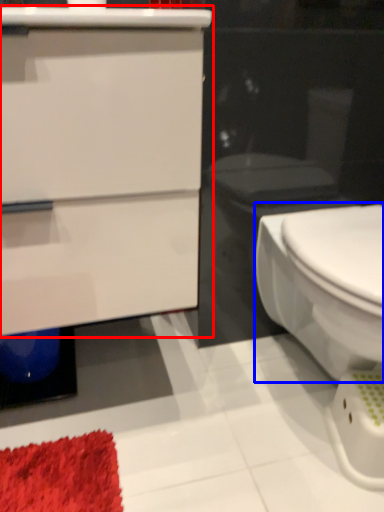
Question: Which object is further to the camera taking this photo, bathroom cabinet (highlighted by a red box) or bidet (highlighted by a blue box)?

Choices:
 (A) bathroom cabinet
 (B) bidet

Answer: (B)